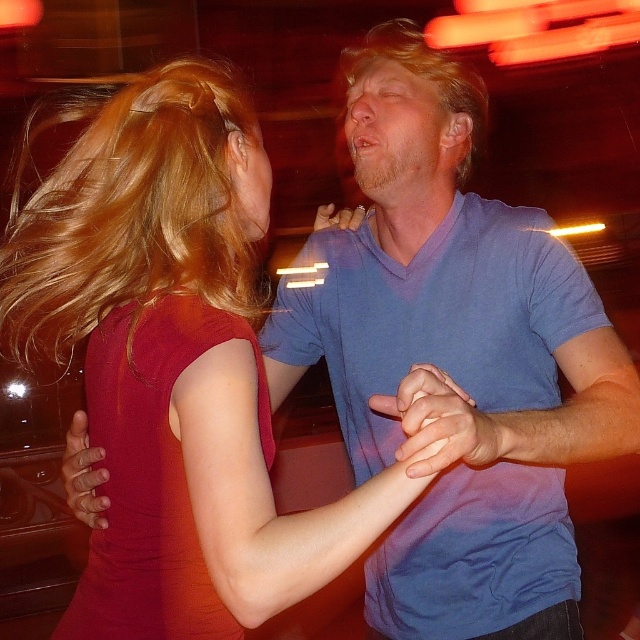
You are a photographer trying to capture the perfect shot of the two people in the image. You want to ensure that the blondehair at upper left and the matte blue shirt at center are both clearly visible in the frame. Based on their positions, which object is lower in the image?

The blondehair at upper left is below matte blue shirt at center, so the blondehair at upper left is lower in the image.

You are a photographer trying to capture the perfect shot of the matte red dress at center. You need to position your camera at point A to focus on the dress. According to the coordinates provided, where should you place your camera relative to the dress?

The matte red dress at center is located at point (176, 364), so you should position your camera at point A directly facing this coordinate to ensure the dress is centered in your shot.